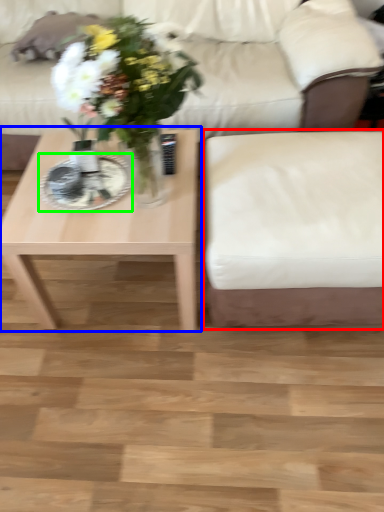
Question: Which is nearer to the armchair (highlighted by a red box)? coffee table (highlighted by a blue box) or plate (highlighted by a green box).

Choices:
 (A) coffee table
 (B) plate

Answer: (A)